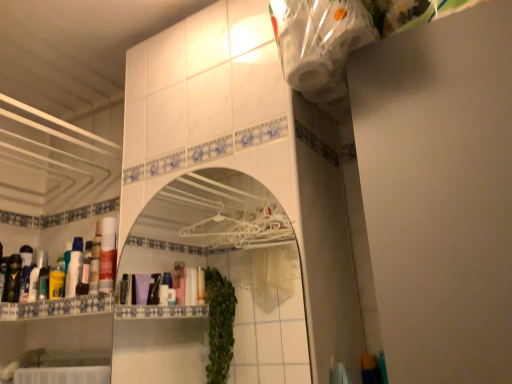
Question: Is white glossy bottle at left, marked as the first toiletry in a right-to-left arrangement, outside of matte black lotion at left, marked as the 2th toiletry in a right-to-left arrangement?

Choices:
 (A) yes
 (B) no

Answer: (A)

Question: Can you confirm if white glossy bottle at left, marked as the first toiletry in a right-to-left arrangement, is smaller than matte black lotion at left, marked as the 2th toiletry in a right-to-left arrangement?

Choices:
 (A) yes
 (B) no

Answer: (A)

Question: Could matte black lotion at left, marked as the 2th toiletry in a right-to-left arrangement, be considered to be inside white glossy bottle at left, arranged as the third toiletry when viewed from the left?

Choices:
 (A) yes
 (B) no

Answer: (B)

Question: Can you confirm if white glossy bottle at left, marked as the first toiletry in a right-to-left arrangement, is taller than matte black lotion at left, which is the 2th toiletry from left to right?

Choices:
 (A) no
 (B) yes

Answer: (A)

Question: Would you consider white glossy bottle at left, arranged as the third toiletry when viewed from the left, to be distant from matte black lotion at left, marked as the 2th toiletry in a right-to-left arrangement?

Choices:
 (A) no
 (B) yes

Answer: (A)

Question: Considering the relative positions of white plastic mirror at center and yellow glossy mouthwash at left, which is counted as the 3th mouthwash, starting from the right, in the image provided, is white plastic mirror at center to the left or to the right of yellow glossy mouthwash at left, which is counted as the 3th mouthwash, starting from the right,?

Choices:
 (A) left
 (B) right

Answer: (B)

Question: Is point (284, 218) closer or farther from the camera than point (61, 279)?

Choices:
 (A) closer
 (B) farther

Answer: (A)

Question: Is white plastic mirror at center wider or thinner than yellow glossy mouthwash at left, which is counted as the 3th mouthwash, starting from the right?

Choices:
 (A) thin
 (B) wide

Answer: (A)

Question: From a real-world perspective, is white plastic mirror at center above or below yellow glossy mouthwash at left, which is counted as the 3th mouthwash, starting from the right?

Choices:
 (A) above
 (B) below

Answer: (B)

Question: Is white plastic mirror at center to the left or to the right of white glossy bottle at left, arranged as the third toiletry when viewed from the left, in the image?

Choices:
 (A) left
 (B) right

Answer: (B)

Question: From the image's perspective, is white plastic mirror at center positioned above or below white glossy bottle at left, marked as the first toiletry in a right-to-left arrangement?

Choices:
 (A) below
 (B) above

Answer: (B)

Question: From a real-world perspective, is white plastic mirror at center physically located above or below white glossy bottle at left, arranged as the third toiletry when viewed from the left?

Choices:
 (A) above
 (B) below

Answer: (B)

Question: Is white plastic mirror at center taller or shorter than white glossy bottle at left, marked as the first toiletry in a right-to-left arrangement?

Choices:
 (A) short
 (B) tall

Answer: (B)

Question: Is white glossy cabinet at lower center wider or thinner than white plastic mirror at center?

Choices:
 (A) thin
 (B) wide

Answer: (B)

Question: Is white glossy cabinet at lower center bigger or smaller than white plastic mirror at center?

Choices:
 (A) big
 (B) small

Answer: (A)